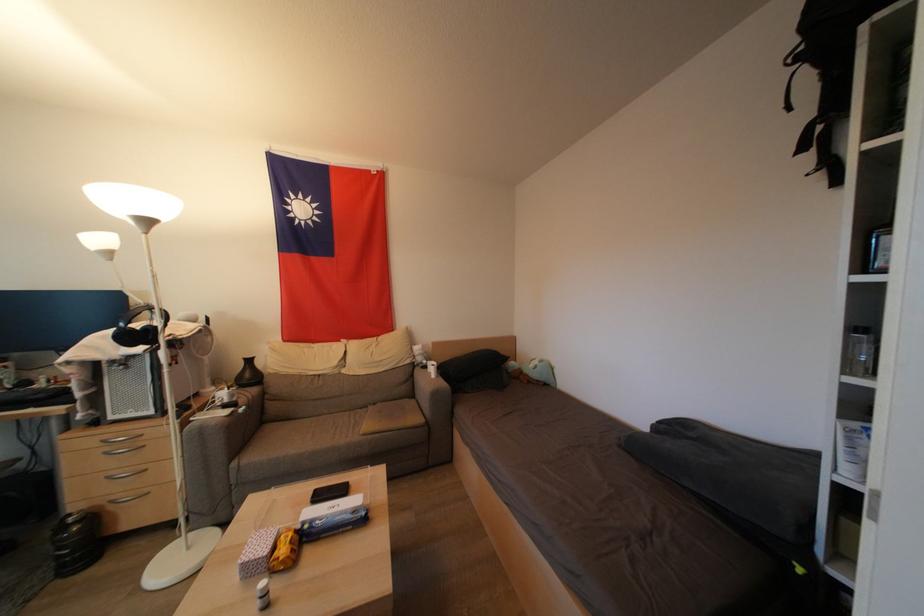
I want to click on black vase, so click(76, 541).